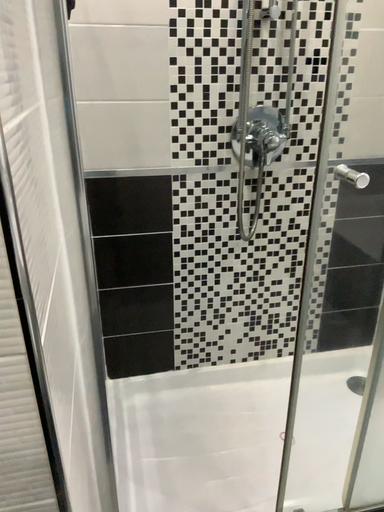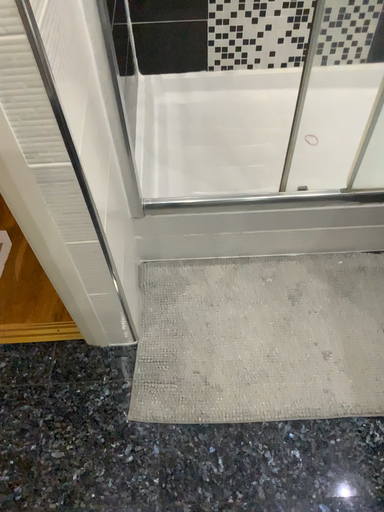
Question: Which way did the camera rotate in the video?

Choices:
 (A) rotated right
 (B) rotated left

Answer: (B)